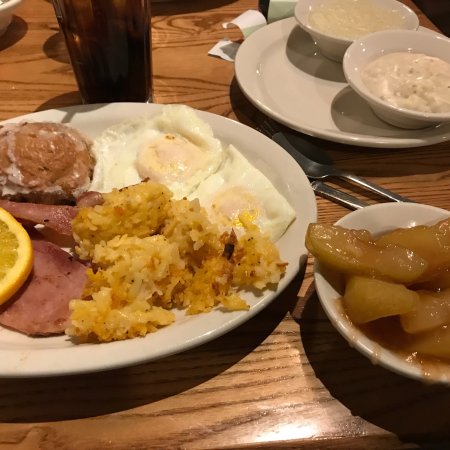
Locate an element on the screen. bowl is located at coordinates (364, 89).